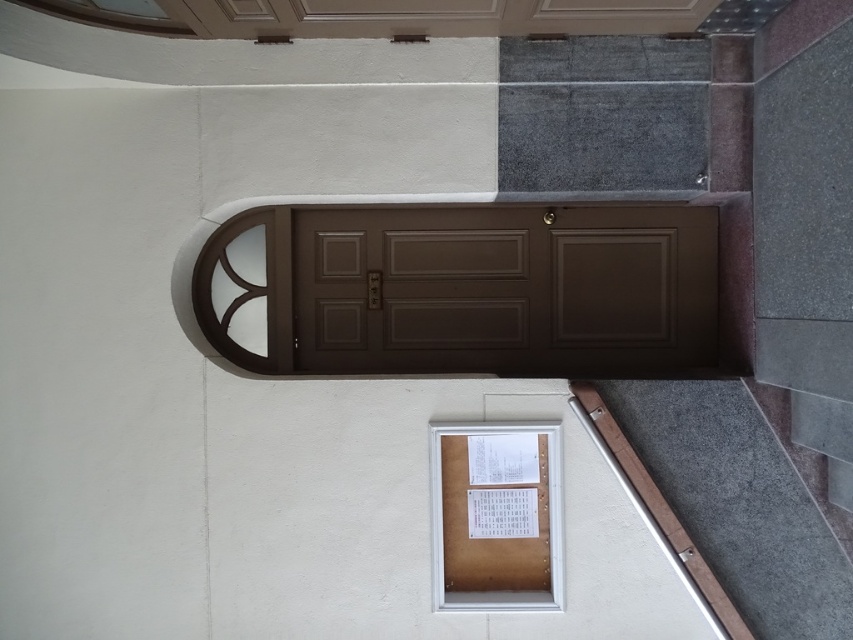
Who is positioned more to the left, gray carpet at lower right or brown cardboard window at lower center?

brown cardboard window at lower center

The width and height of the screenshot is (853, 640). What do you see at coordinates (737, 502) in the screenshot?
I see `gray carpet at lower right` at bounding box center [737, 502].

Locate an element on the screen. gray carpet at lower right is located at coordinates (737, 502).

Which of these two, brown matte door at center or brown cardboard window at lower center, stands shorter?

brown matte door at center

Measure the distance between point (404, 348) and camera.

Point (404, 348) and camera are 17.15 feet apart from each other.

Who is more forward, (519, 228) or (517, 536)?

Point (517, 536)

Find the location of a particular element. The height and width of the screenshot is (640, 853). brown matte door at center is located at coordinates (419, 289).

Is brown matte door at center to the right of gray carpet at lower right from the viewer's perspective?

Incorrect, brown matte door at center is not on the right side of gray carpet at lower right.

Between point (485, 362) and point (703, 412), which one is positioned behind?

Positioned behind is point (485, 362).

Does point (444, 230) lie in front of point (735, 467)?

No, (444, 230) is further to viewer.

Find the location of a particular element. The image size is (853, 640). brown matte door at center is located at coordinates (419, 289).